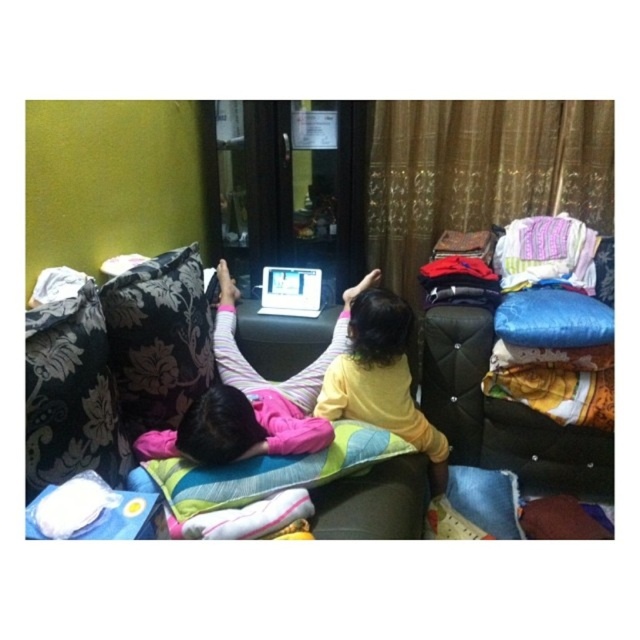
Looking at this image, does yellow matte shirt at center have a greater height compared to pink fleece pants at center?

Indeed, yellow matte shirt at center has a greater height compared to pink fleece pants at center.

Between yellow matte shirt at center and pink fleece pants at center, which one appears on the left side from the viewer's perspective?

From the viewer's perspective, pink fleece pants at center appears more on the left side.

Between point (400, 316) and point (342, 337), which one is positioned in front?

Positioned in front is point (400, 316).

Identify the location of yellow matte shirt at center. (381, 380).

Between point (353, 292) and point (410, 371), which one is positioned behind?

Point (353, 292)

Does floral fabric couch at center lie behind yellow matte shirt at center?

No, it is in front of yellow matte shirt at center.

Where is `floral fabric couch at center`? This screenshot has height=640, width=640. floral fabric couch at center is located at coordinates (252, 397).

Can you confirm if pink fleece pants at center is smaller than white glossy laptop at center?

Incorrect, pink fleece pants at center is not smaller in size than white glossy laptop at center.

At what (x,y) coordinates should I click in order to perform the action: click on pink fleece pants at center. Please return your answer as a coordinate pair (x, y). This screenshot has height=640, width=640. Looking at the image, I should click on (227, 404).

The image size is (640, 640). Find the location of `pink fleece pants at center`. pink fleece pants at center is located at coordinates (227, 404).

Find the location of a particular element. pink fleece pants at center is located at coordinates (227, 404).